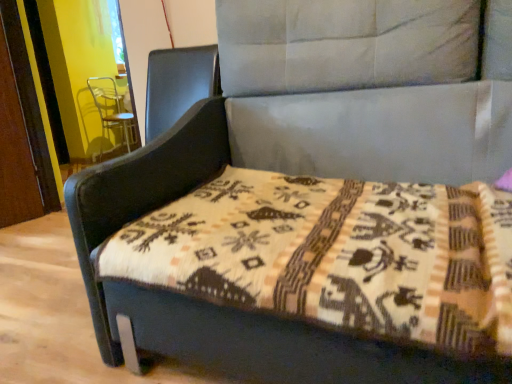
What do you see at coordinates (112, 109) in the screenshot? This screenshot has height=384, width=512. I see `metallic silver swivel chair at upper left` at bounding box center [112, 109].

This screenshot has height=384, width=512. Find the location of `metallic silver swivel chair at upper left`. metallic silver swivel chair at upper left is located at coordinates (112, 109).

What do you see at coordinates (336, 256) in the screenshot? I see `beige woven mattress at center` at bounding box center [336, 256].

Find the location of `beige woven mattress at center`. beige woven mattress at center is located at coordinates (336, 256).

Locate an element on the screen. metallic silver swivel chair at upper left is located at coordinates (112, 109).

Considering the positions of objects beige woven mattress at center and metallic silver swivel chair at upper left in the image provided, who is more to the left, beige woven mattress at center or metallic silver swivel chair at upper left?

Positioned to the left is metallic silver swivel chair at upper left.

Which object is more forward, beige woven mattress at center or metallic silver swivel chair at upper left?

Positioned in front is beige woven mattress at center.

Which is farther, [499,334] or [95,99]?

The point [95,99] is more distant.

From the image's perspective, is beige woven mattress at center located beneath metallic silver swivel chair at upper left?

Correct, beige woven mattress at center appears lower than metallic silver swivel chair at upper left in the image.

From a real-world perspective, is beige woven mattress at center located beneath metallic silver swivel chair at upper left?

Correct, in the physical world, beige woven mattress at center is lower than metallic silver swivel chair at upper left.

Considering the relative sizes of beige woven mattress at center and metallic silver swivel chair at upper left in the image provided, is beige woven mattress at center thinner than metallic silver swivel chair at upper left?

No, beige woven mattress at center is not thinner than metallic silver swivel chair at upper left.

Considering the relative sizes of beige woven mattress at center and metallic silver swivel chair at upper left in the image provided, is beige woven mattress at center shorter than metallic silver swivel chair at upper left?

Yes.

Considering the relative sizes of beige woven mattress at center and metallic silver swivel chair at upper left in the image provided, is beige woven mattress at center bigger than metallic silver swivel chair at upper left?

No.

Is beige woven mattress at center not within metallic silver swivel chair at upper left?

Yes, beige woven mattress at center is outside of metallic silver swivel chair at upper left.

Is beige woven mattress at center not near metallic silver swivel chair at upper left?

That's right, there is a large distance between beige woven mattress at center and metallic silver swivel chair at upper left.

Could you tell me if beige woven mattress at center is turned towards metallic silver swivel chair at upper left?

No.

How many degrees apart are the facing directions of beige woven mattress at center and metallic silver swivel chair at upper left?

178 degrees separate the facing orientations of beige woven mattress at center and metallic silver swivel chair at upper left.

At what (x,y) coordinates should I click in order to perform the action: click on swivel chair behind the beige woven mattress at center. Please return your answer as a coordinate pair (x, y). This screenshot has height=384, width=512. Looking at the image, I should click on (112, 109).

Which object is positioned more to the left, metallic silver swivel chair at upper left or beige woven mattress at center?

Positioned to the left is metallic silver swivel chair at upper left.

Which is behind, metallic silver swivel chair at upper left or beige woven mattress at center?

metallic silver swivel chair at upper left.

Is point (102, 101) closer or farther from the camera than point (424, 214)?

Point (102, 101) is farther from the camera than point (424, 214).

From the image's perspective, which one is positioned lower, metallic silver swivel chair at upper left or beige woven mattress at center?

beige woven mattress at center is shown below in the image.

From a real-world perspective, is metallic silver swivel chair at upper left over beige woven mattress at center?

Yes, from a real-world perspective, metallic silver swivel chair at upper left is on top of beige woven mattress at center.

Does metallic silver swivel chair at upper left have a lesser width compared to beige woven mattress at center?

Yes, metallic silver swivel chair at upper left is thinner than beige woven mattress at center.

From their relative heights in the image, would you say metallic silver swivel chair at upper left is taller or shorter than beige woven mattress at center?

Clearly, metallic silver swivel chair at upper left is taller compared to beige woven mattress at center.

Which of these two, metallic silver swivel chair at upper left or beige woven mattress at center, is bigger?

With larger size is metallic silver swivel chair at upper left.

Do you think metallic silver swivel chair at upper left is within beige woven mattress at center, or outside of it?

metallic silver swivel chair at upper left lies outside beige woven mattress at center.

Is metallic silver swivel chair at upper left next to beige woven mattress at center?

No.

Could you tell me if metallic silver swivel chair at upper left is turned towards beige woven mattress at center?

No, metallic silver swivel chair at upper left is not aimed at beige woven mattress at center.

How different are the orientations of metallic silver swivel chair at upper left and beige woven mattress at center in degrees?

The angular difference between metallic silver swivel chair at upper left and beige woven mattress at center is 178 degrees.

Image resolution: width=512 pixels, height=384 pixels. In order to click on mattress below the metallic silver swivel chair at upper left (from the image's perspective) in this screenshot , I will do `click(336, 256)`.

Where is `swivel chair on the left of beige woven mattress at center`? This screenshot has width=512, height=384. swivel chair on the left of beige woven mattress at center is located at coordinates (112, 109).

Find the location of a particular element. Image resolution: width=512 pixels, height=384 pixels. mattress below the metallic silver swivel chair at upper left (from a real-world perspective) is located at coordinates (336, 256).